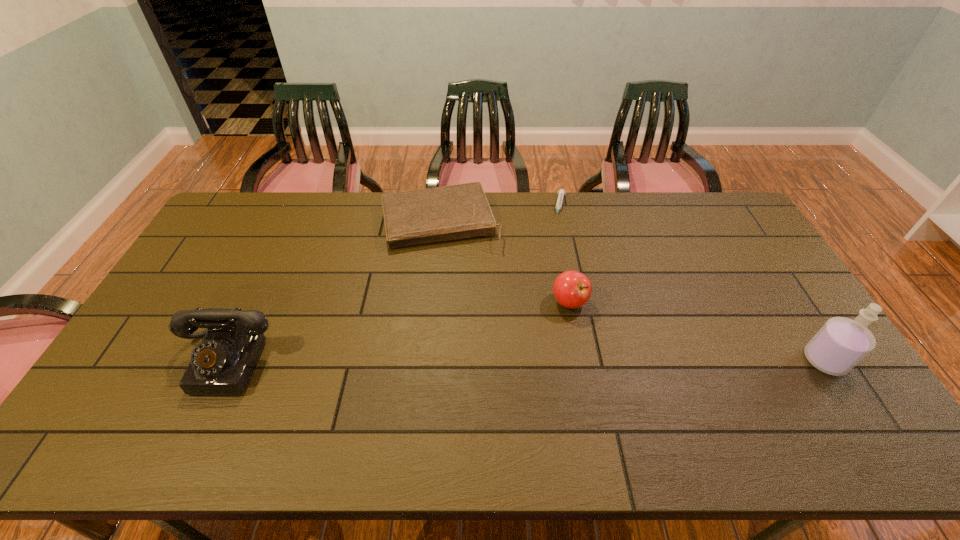
You are a GUI agent. You are given a task and a screenshot of the screen. Output one action in this format:
    pyautogui.click(x=<x>, y=<y>)
    Task: Click on the free space on the desktop that is between the telephone and the tallest object and is positioned on the stem of the third farthest object
    This screenshot has height=540, width=960.
    Given the screenshot: What is the action you would take?
    pyautogui.click(x=573, y=361)

This screenshot has width=960, height=540. I want to click on vacant space on the desktop that is between the second tallest object and the rightmost object and is positioned at the needle end of the syringe, so click(528, 361).

I want to click on free spot on the desktop that is between the leftmost object and the perfume and is positioned on the spine side of the paperback book, so click(x=475, y=361).